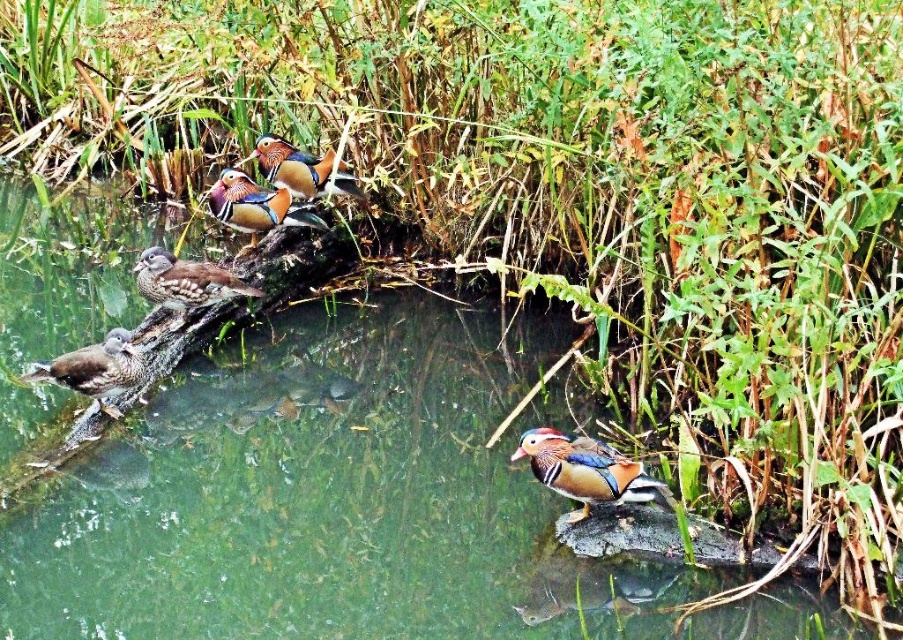
You are observing a serene natural scene with a log and ducks. There is a shiny multicolored duck at center. From your viewpoint, where is the shiny multicolored duck positioned relative to the log?

The shiny multicolored duck at center is located at point 0.738 on the horizontal axis and 0.652 on the vertical axis relative to the log.